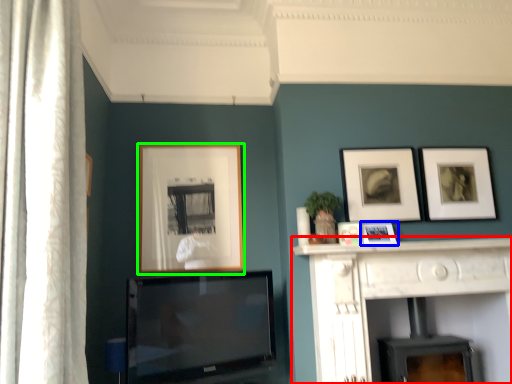
Question: Estimate the real-world distances between objects in this image. Which object is farther from fireplace (highlighted by a red box), picture frame (highlighted by a blue box) or picture frame (highlighted by a green box)?

Choices:
 (A) picture frame
 (B) picture frame

Answer: (B)